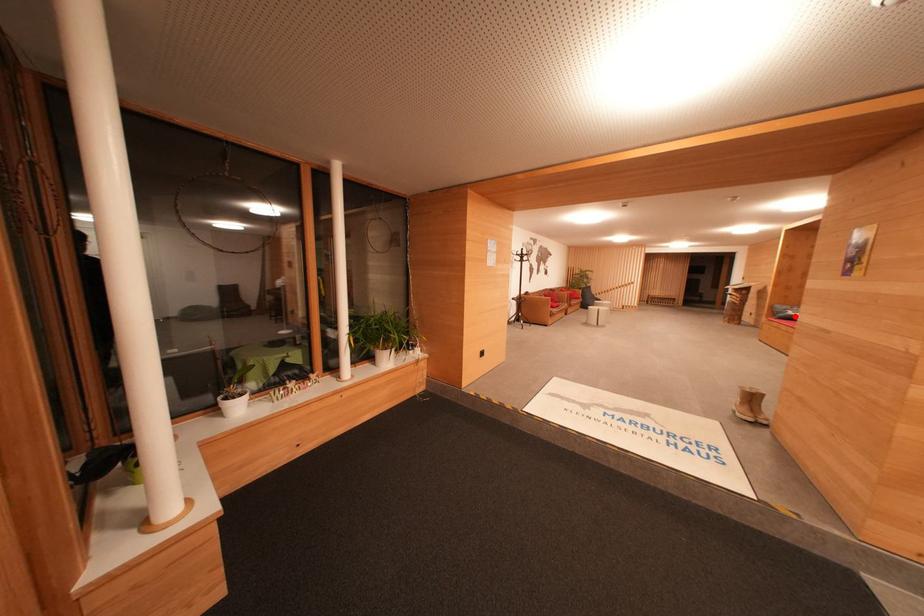
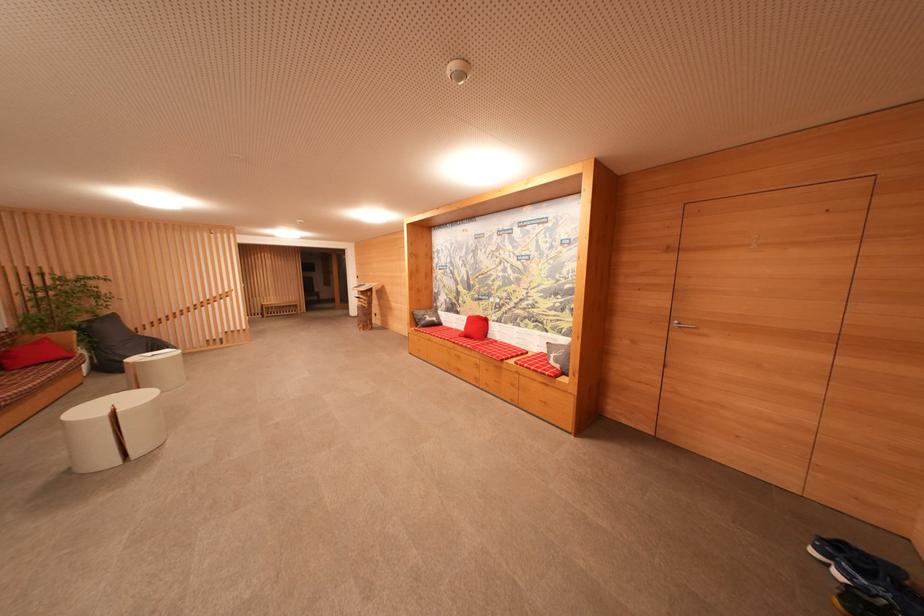
Question: I am providing you with two images of the same scene from different viewpoints. Image1 has a red point marked. In image2, the corresponding 3D location appears at what relative position? Reply with the corresponding letter.

Choices:
 (A) Closer
 (B) Farther

Answer: (A)